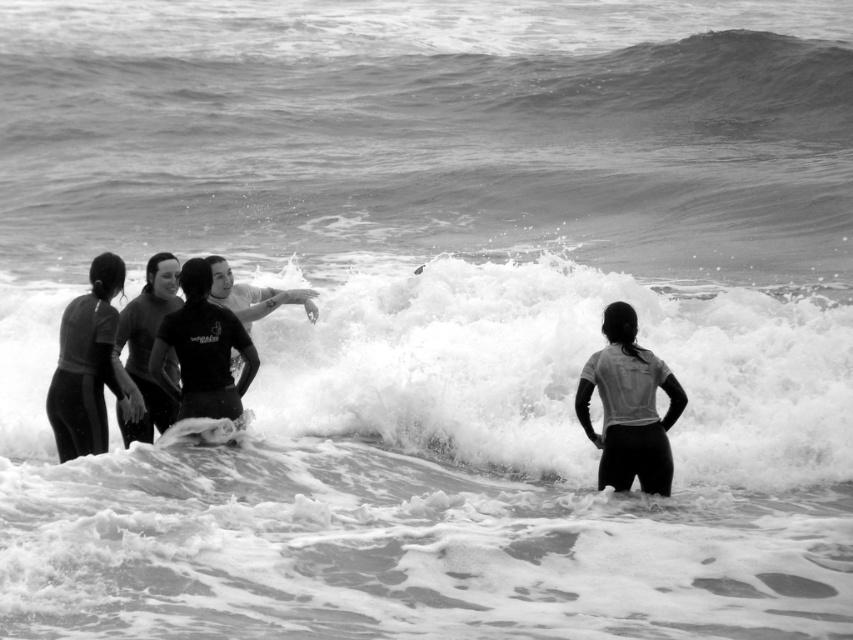
Consider the image. You are a photographer trying to capture a photo of both the light gray matte wetsuit at right and the black matte wetsuit at left. Since you want both subjects to be in focus, which one should you adjust your camera focus on first?

You should focus on the light gray matte wetsuit at right first because it is closer to the viewer than the black matte wetsuit at left. By focusing on the closer subject, the farther one may still be in acceptable focus depending on the depth of field.

You are a photographer standing at the beach scene. You want to take a photo that includes both the point at coordinates point (593, 438) and point (231, 429). Since you want the closer point to be in focus, which point should you focus on?

Point (593, 438) is closer to the camera than point (231, 429), so you should focus on point (593, 438) to ensure it is in focus.

You are a photographer trying to capture a photo of the light gray matte wetsuit at right and the white frothy wave at center. From your current position, which object is closer to the left side of your frame?

The white frothy wave at center is to the left of the light gray matte wetsuit at right, so the white frothy wave at center would be closer to the left side of the frame.